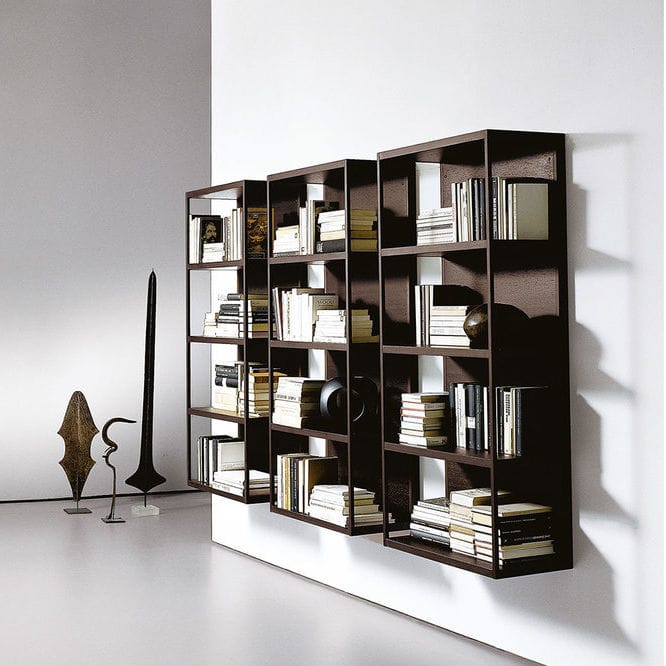
The image size is (666, 666). Identify the location of bookshelf one, first shelf. (222, 268), (196, 262), (214, 264), (238, 266).